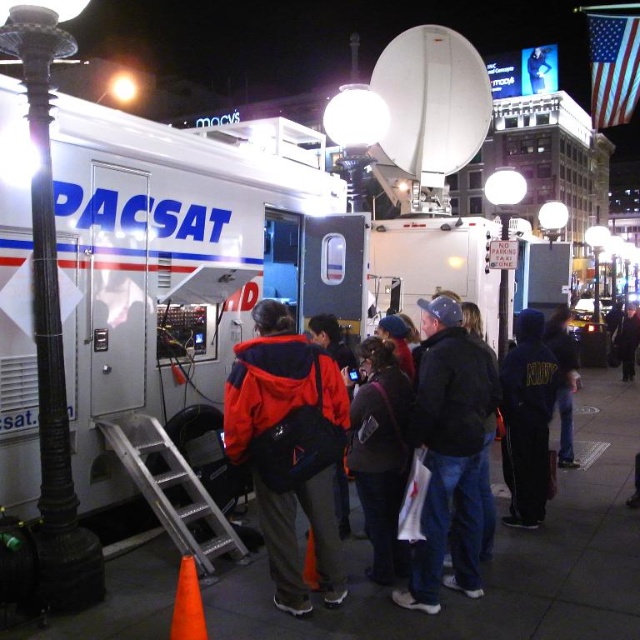
Question: Which of the following is the farthest from the observer?

Choices:
 (A) black leather jacket at center
 (B) red nylon backpack at center

Answer: (A)

Question: Does dark blue denim jacket at center have a greater width compared to orange matte cone at lower left?

Choices:
 (A) no
 (B) yes

Answer: (B)

Question: Which point is closer to the camera?

Choices:
 (A) silver/aluminum ladder at lower left
 (B) orange matte cone at lower left

Answer: (B)

Question: Is white plastic truck at center above red nylon backpack at center?

Choices:
 (A) yes
 (B) no

Answer: (A)

Question: Is red jacket at center further to the viewer compared to red nylon backpack at center?

Choices:
 (A) no
 (B) yes

Answer: (B)

Question: Which is nearer to the red nylon backpack at center?

Choices:
 (A) dark gray backpack at center
 (B) silver/aluminum ladder at lower left
 (C) dark blue denim jacket at center

Answer: (A)